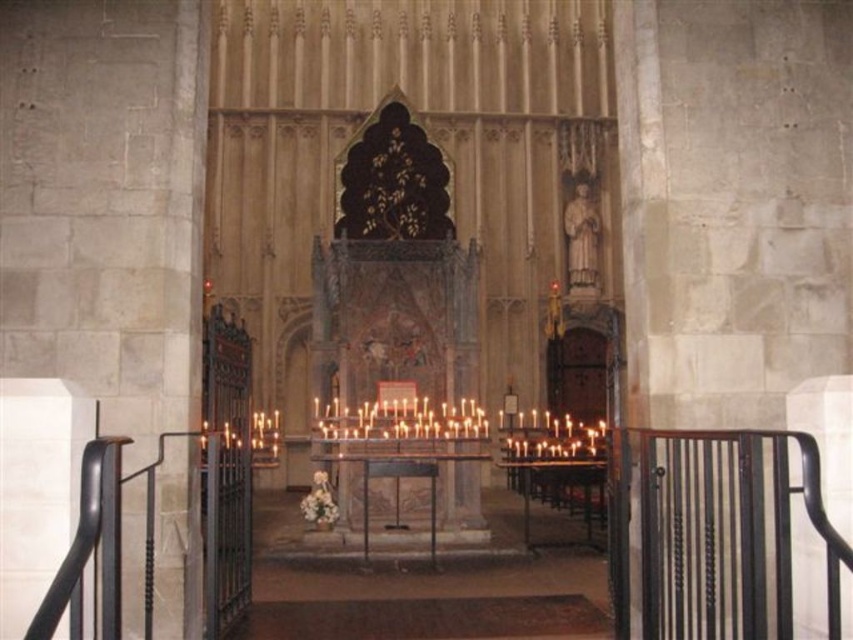
Question: Which object is farther from the camera taking this photo?

Choices:
 (A) black metal railing at lower right
 (B) black metal railing at left

Answer: (A)

Question: Can you confirm if black metal railing at lower right is smaller than black metal railing at left?

Choices:
 (A) no
 (B) yes

Answer: (B)

Question: Observing the image, what is the correct spatial positioning of black metal railing at lower right in reference to black metal railing at left?

Choices:
 (A) below
 (B) above

Answer: (B)

Question: Is black metal railing at lower right below black metal railing at left?

Choices:
 (A) yes
 (B) no

Answer: (B)